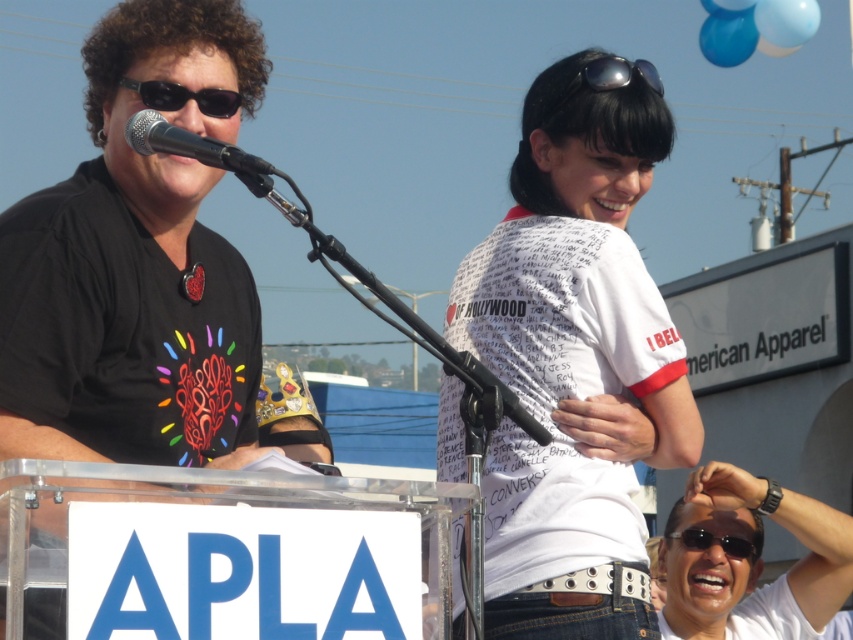
Based on the photo, you are at the event and want to move from point A to point B. Point A is at coordinate point(537, 214) and point B is at coordinate point(612, 65). Which point is closer to you?

Point(537, 214) is closer to you because it is further to the viewer than point(612, 65).

You are standing in front of the podium and want to locate the point with coordinates [578,262]. According to the scene description, where would this point be located?

The point with coordinates [578,262] is on the white printed t shirt at center.

You are a fashion designer observing the sunglasses at an event. You need to choose a pair for a client who prefers wider frames. Which sunglasses between the white matte sunglasses at upper right and the black plastic sunglasses at left would you recommend?

The white matte sunglasses at upper right has a larger width than the black plastic sunglasses at left, so I would recommend the white matte sunglasses at upper right for the client who prefers wider frames.